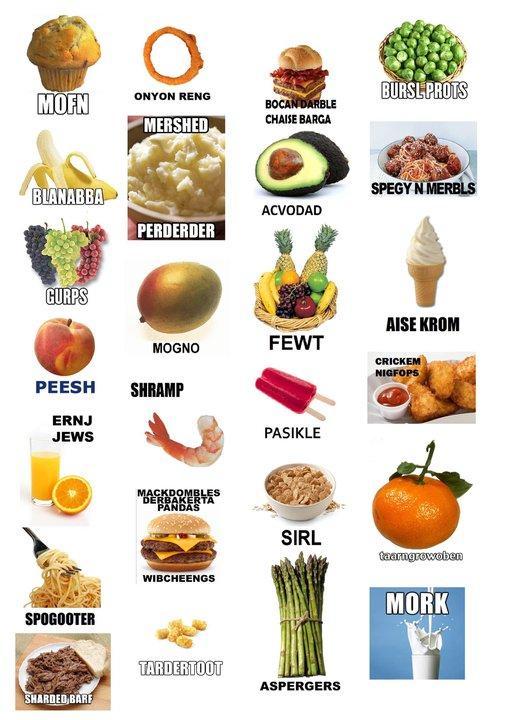
Locate an element on the screen. This screenshot has height=720, width=505. column 4 is located at coordinates 413,3.